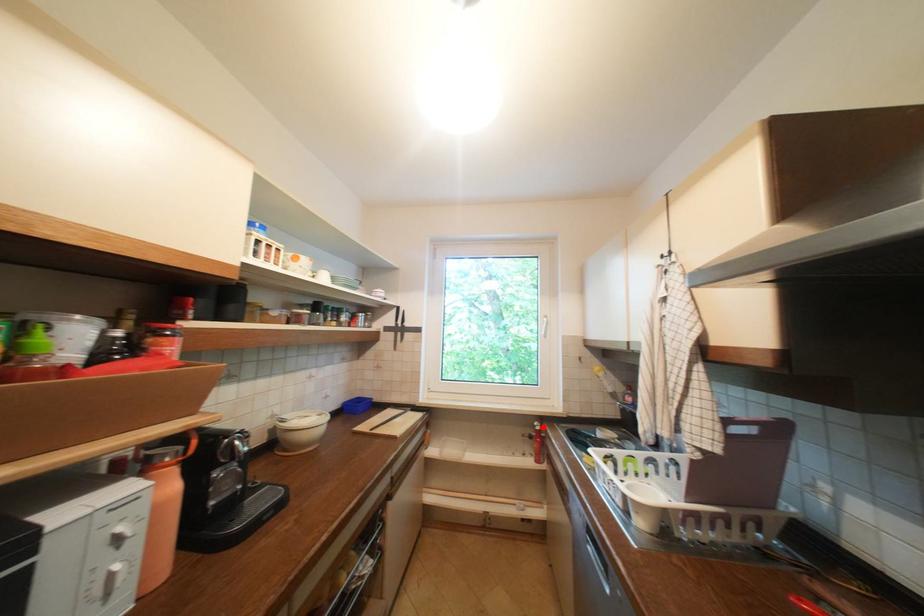
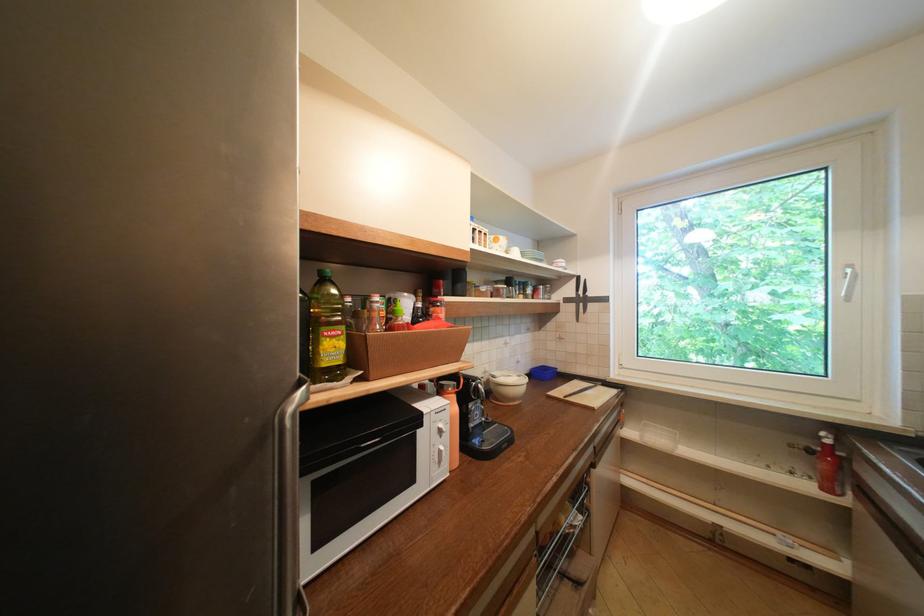
Question: I am providing you with two images of the same scene from different viewpoints. A red point is shown in image1. For the corresponding object point in image2, is it positioned nearer or farther from the camera?

Choices:
 (A) Nearer
 (B) Farther

Answer: (A)